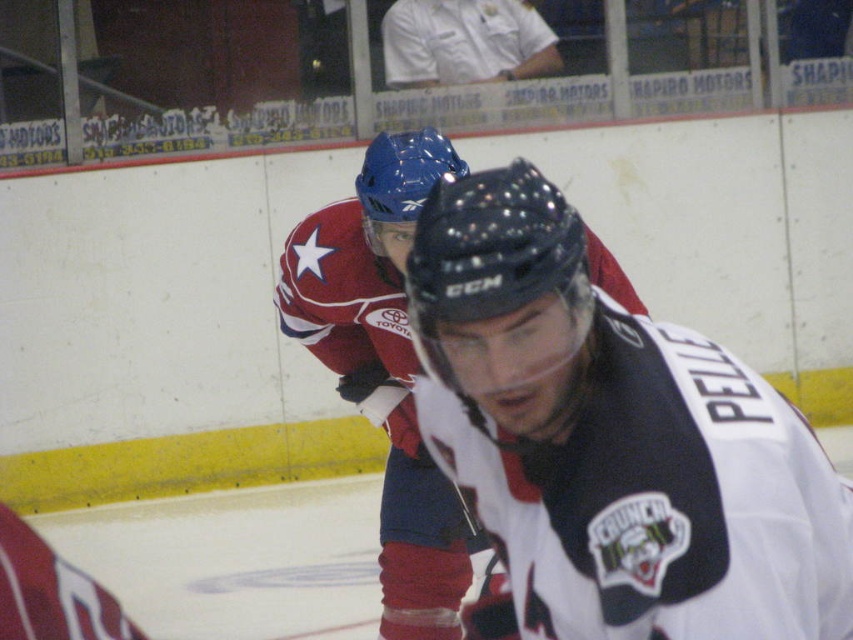
Between white matte jersey at center and white cotton shirt at upper center, which one has less height?

white cotton shirt at upper center is shorter.

Measure the distance between white matte jersey at center and white cotton shirt at upper center.

white matte jersey at center and white cotton shirt at upper center are 22.67 feet apart.

This screenshot has height=640, width=853. Describe the element at coordinates (612, 440) in the screenshot. I see `white matte jersey at center` at that location.

Locate an element on the screen. This screenshot has height=640, width=853. white matte jersey at center is located at coordinates (612, 440).

Which is more to the right, white matte jersey at center or red jersey at center?

Positioned to the right is white matte jersey at center.

Between white matte jersey at center and red jersey at center, which one has less height?

white matte jersey at center is shorter.

Is point (520, 282) more distant than point (402, 534)?

No, it is not.

You are a GUI agent. You are given a task and a screenshot of the screen. Output one action in this format:
    pyautogui.click(x=<x>, y=<y>)
    Task: Click on the white matte jersey at center
    This screenshot has width=853, height=640.
    Given the screenshot: What is the action you would take?
    (x=612, y=440)

Between red jersey at center and white cotton shirt at upper center, which one is positioned lower?

Positioned lower is red jersey at center.

Between red jersey at center and white cotton shirt at upper center, which one has less height?

Standing shorter between the two is white cotton shirt at upper center.

Locate an element on the screen. red jersey at center is located at coordinates (384, 369).